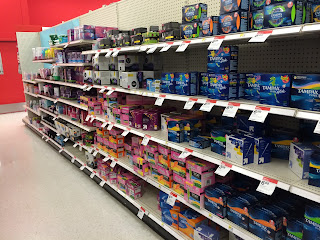
What are the coordinates of `beige floor with tiny black dots` in the screenshot? It's located at (74, 215).